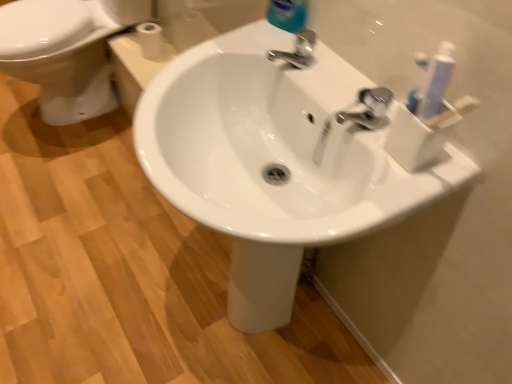
Find the location of a particular element. The width and height of the screenshot is (512, 384). vacant space situated on the left part of white glossy sink at center is located at coordinates (116, 284).